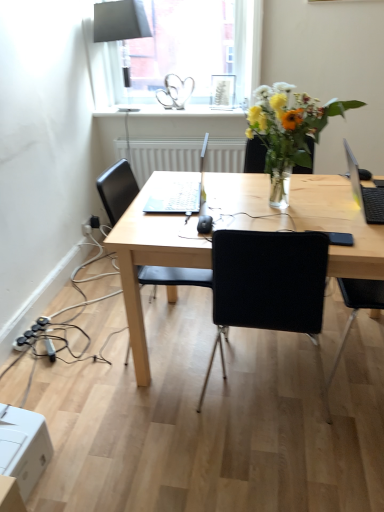
Question: Is white cardboard box at lower left facing towards white glossy window sill at upper center?

Choices:
 (A) no
 (B) yes

Answer: (A)

Question: Is white cardboard box at lower left closer to the viewer compared to white glossy window sill at upper center?

Choices:
 (A) no
 (B) yes

Answer: (B)

Question: Is white cardboard box at lower left to the left of white glossy window sill at upper center from the viewer's perspective?

Choices:
 (A) no
 (B) yes

Answer: (B)

Question: Is white cardboard box at lower left thinner than white glossy window sill at upper center?

Choices:
 (A) yes
 (B) no

Answer: (A)

Question: From a real-world perspective, is white cardboard box at lower left below white glossy window sill at upper center?

Choices:
 (A) no
 (B) yes

Answer: (B)

Question: Considering the relative sizes of white cardboard box at lower left and white glossy window sill at upper center in the image provided, is white cardboard box at lower left bigger than white glossy window sill at upper center?

Choices:
 (A) yes
 (B) no

Answer: (B)

Question: Is black matte laptop at right to the right of light wood desk at center from the viewer's perspective?

Choices:
 (A) no
 (B) yes

Answer: (B)

Question: Is black matte laptop at right further to camera compared to light wood desk at center?

Choices:
 (A) no
 (B) yes

Answer: (B)

Question: From a real-world perspective, does black matte laptop at right stand above light wood desk at center?

Choices:
 (A) no
 (B) yes

Answer: (B)

Question: From the image's perspective, is black matte laptop at right over light wood desk at center?

Choices:
 (A) no
 (B) yes

Answer: (B)

Question: Considering the relative sizes of black matte laptop at right and light wood desk at center in the image provided, is black matte laptop at right taller than light wood desk at center?

Choices:
 (A) no
 (B) yes

Answer: (A)

Question: Is black matte laptop at right far from light wood desk at center?

Choices:
 (A) no
 (B) yes

Answer: (A)

Question: Is sleek silver laptop at center surrounding matte black lampshade at upper center?

Choices:
 (A) yes
 (B) no

Answer: (B)